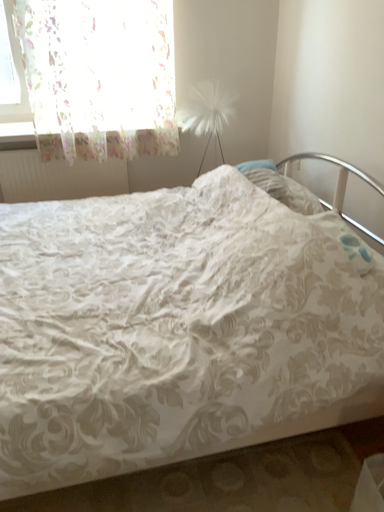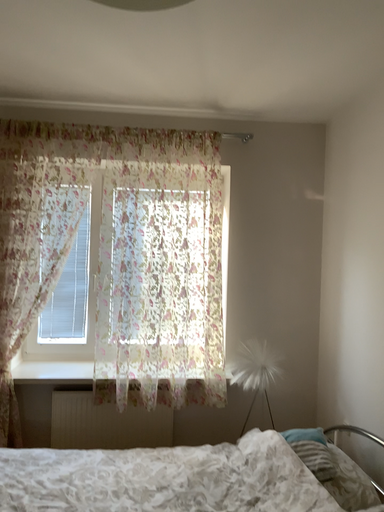
Question: Which way did the camera rotate in the video?

Choices:
 (A) rotated upward
 (B) rotated downward

Answer: (A)